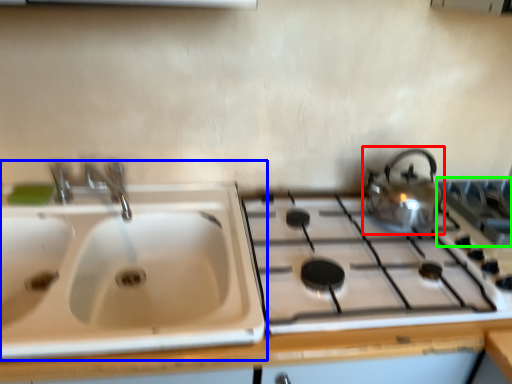
Question: Based on their relative distances, which object is farther from kettle (highlighted by a red box)? Choose from sink (highlighted by a blue box) and gas stove (highlighted by a green box).

Choices:
 (A) sink
 (B) gas stove

Answer: (A)